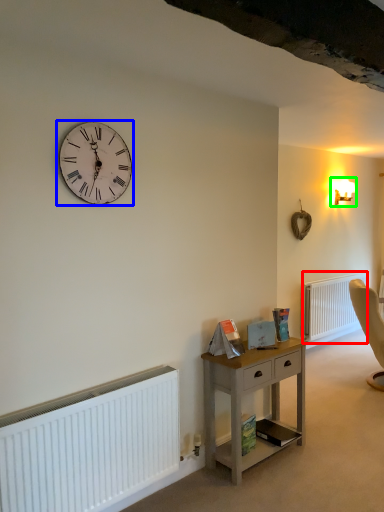
Question: Which object is positioned farthest from radiator (highlighted by a red box)? Select from wall clock (highlighted by a blue box) and light fixture (highlighted by a green box).

Choices:
 (A) wall clock
 (B) light fixture

Answer: (A)